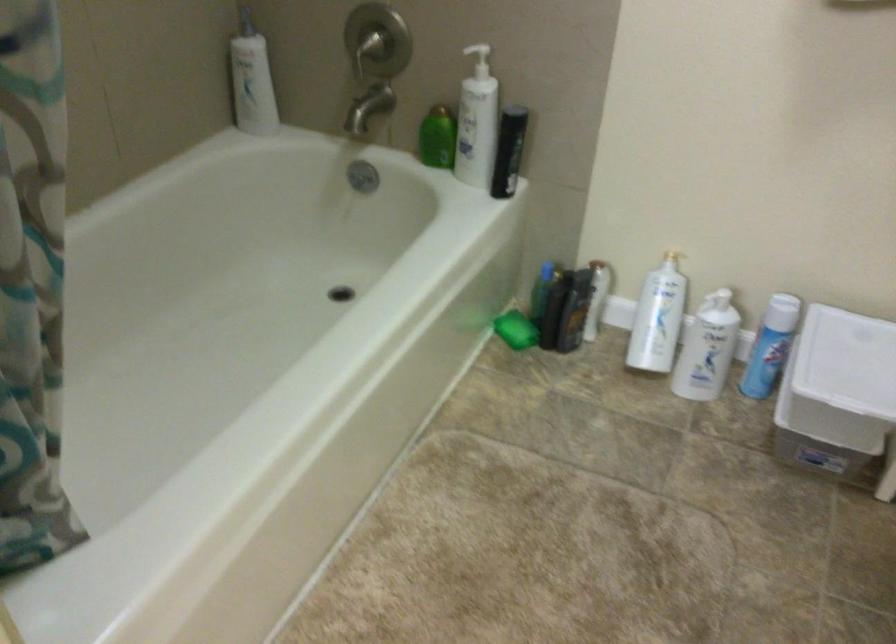
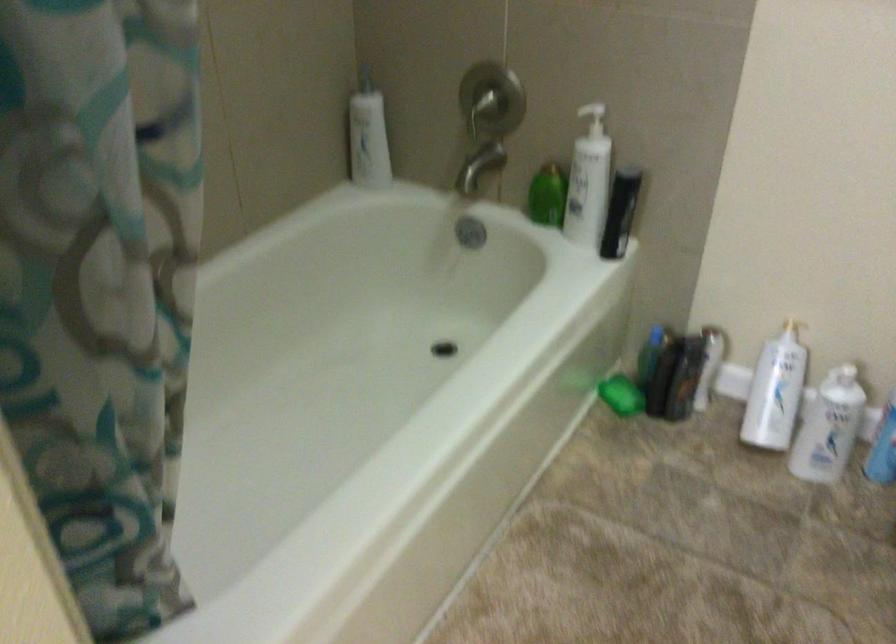
Which direction would the cameraman need to move to produce the second image?

The cameraman moved toward left, forward.